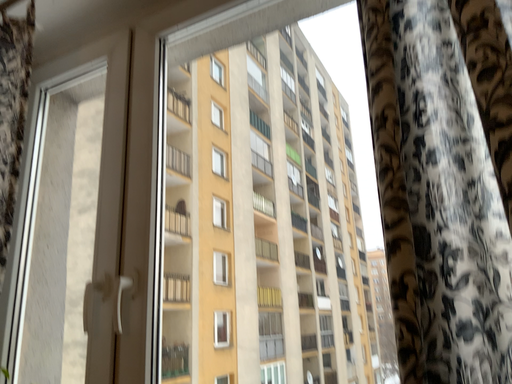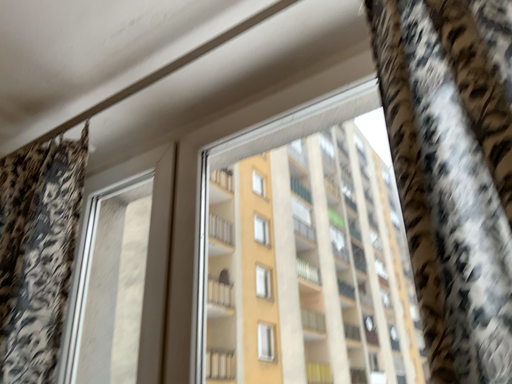
Question: How did the camera likely rotate when shooting the video?

Choices:
 (A) rotated left
 (B) rotated right

Answer: (A)